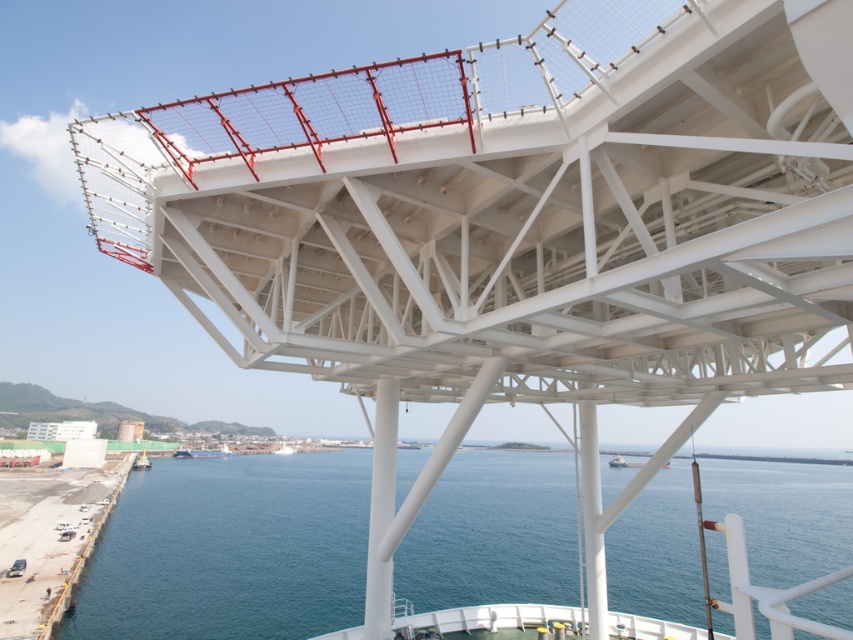
You are a crane operator trying to load cargo onto the yellow matte boat at lower left and the white matte boat at center. The crane has a maximum reach of 25 meters. Can you reach both boats with the crane without moving it?

The yellow matte boat at lower left is 23.67 meters away from the white matte boat at center. Since the crane can reach up to 25 meters, it can reach both boats as the distance between them is within the crane operator reach.

You are standing on the deck of the ship and want to locate the yellow matte boat at lower left. According to the coordinates provided, where exactly should you look to find it?

The yellow matte boat at lower left is located at the 2D coordinates point [141,461].

You are standing on the ship and looking down at the structure. There is a point marked at coordinates point (231, 548). Where is this point located relative to the ship?

The point (231, 548) is on blue water at center, so it is located on the water in the central area of the ship structure.